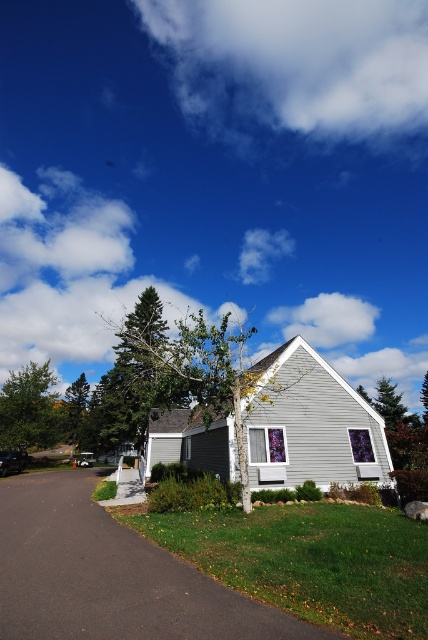
You are standing in the front yard of the house and want to take a photo of both the green leafy tree at center and the green matte tree at upper left. Which tree should you focus on first to ensure both are in clear view?

You should focus on the green leafy tree at center first because it is closer to you than the green matte tree at upper left, so adjusting the focus from near to far will help capture both trees clearly.

You are standing at the front of the house and want to walk to the green matte tree at upper left. Which direction should you head towards from the dark asphalt driveway at lower left?

You should head towards the upper left direction from the dark asphalt driveway at lower left to reach the green matte tree at upper left because the driveway is closer to the viewer, so the tree is located in the upper left area further away.

You are a delivery person who needs to park your van, which is 7 meters long, on the dark asphalt driveway at lower left. The green matte tree at upper left is in the way. Can you park your van there without hitting the tree?

The dark asphalt driveway at lower left and the green matte tree at upper left are 17.33 meters apart from each other. Since the van is only 7 meters long, there is enough space between them to park without hitting the tree.